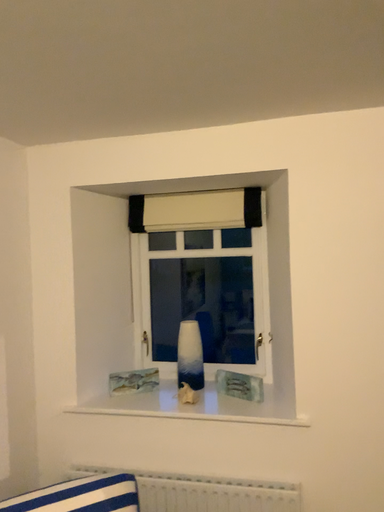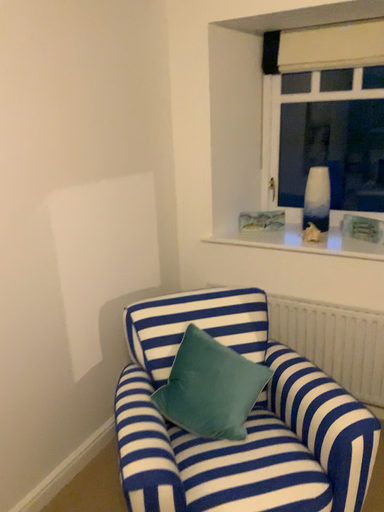
Question: How did the camera likely rotate when shooting the video?

Choices:
 (A) rotated right
 (B) rotated left

Answer: (B)